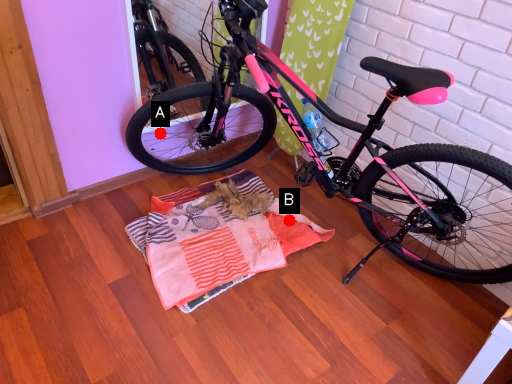
Question: Two points are circled on the image, labeled by A and B beside each circle. Among these points, which one is farthest from the camera?

Choices:
 (A) A is further
 (B) B is further

Answer: (A)